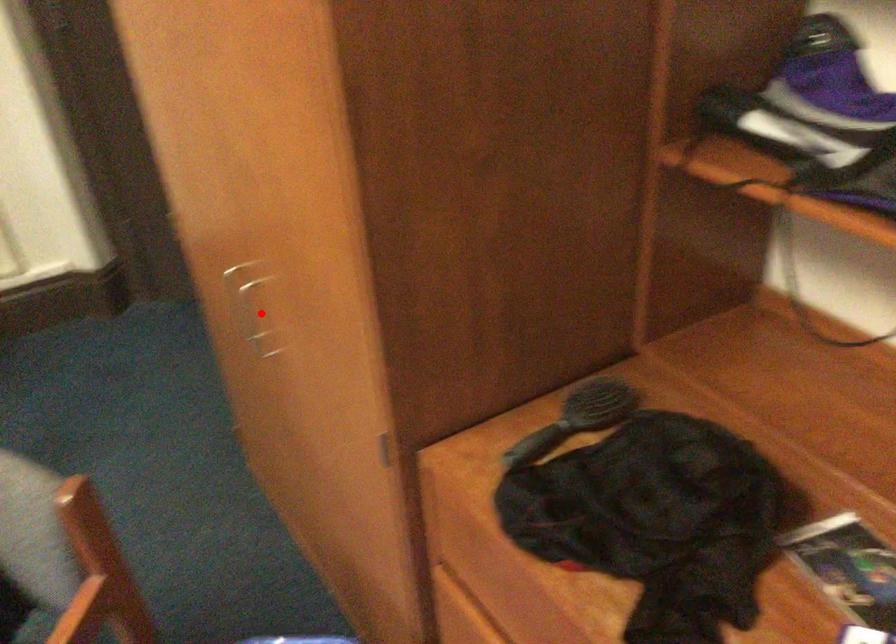
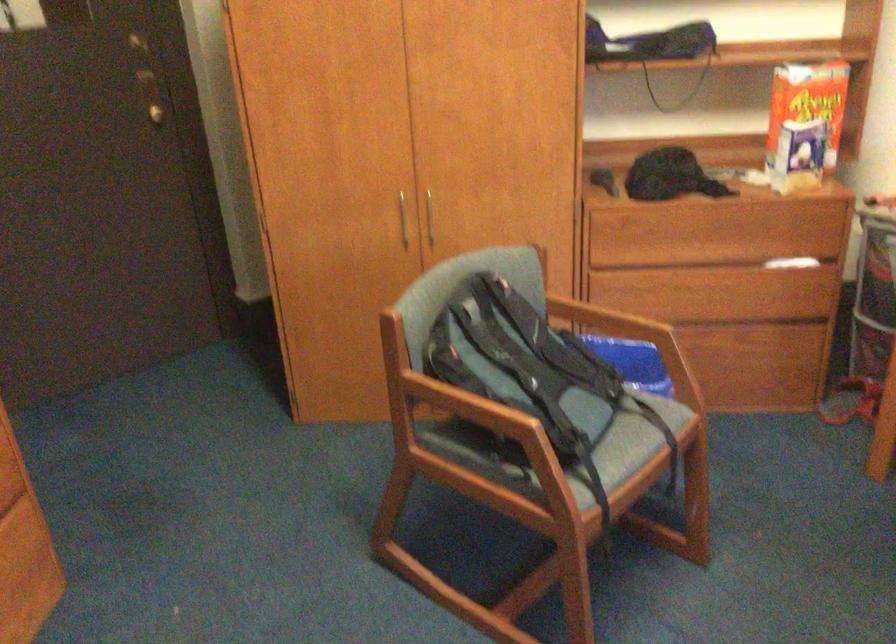
Question: I am providing you with two images of the same scene from different viewpoints. Image1 has a red point marked. In image2, the corresponding 3D location appears at what relative position? Reply with the corresponding letter.

Choices:
 (A) Closer
 (B) Farther

Answer: (B)